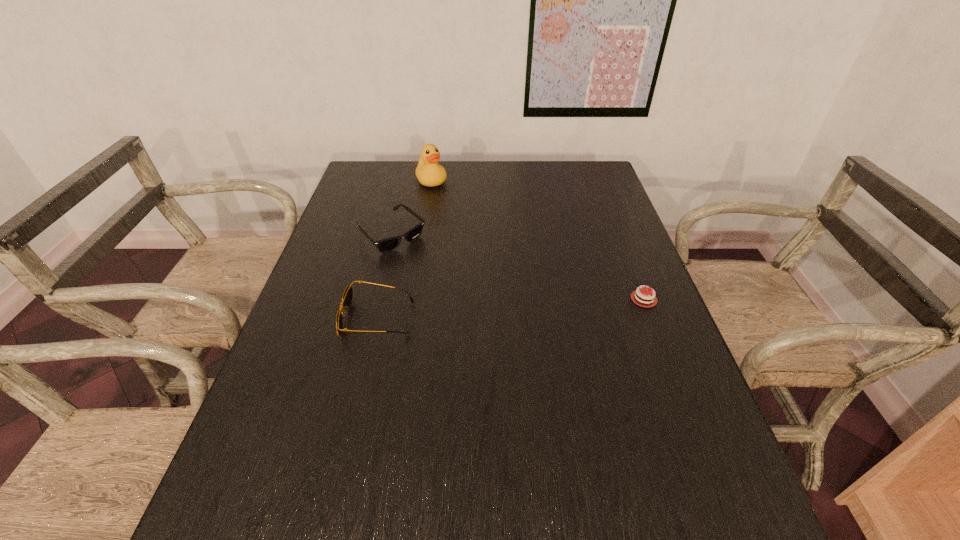
Where is `empty location between the nearer sunglasses and the farther sunglasses`? Image resolution: width=960 pixels, height=540 pixels. empty location between the nearer sunglasses and the farther sunglasses is located at coordinates [385, 277].

I want to click on free space that is in between the farther sunglasses and the nearer sunglasses, so click(385, 277).

Where is `free space that is in between the duck and the nearer sunglasses`? Image resolution: width=960 pixels, height=540 pixels. free space that is in between the duck and the nearer sunglasses is located at coordinates (405, 249).

Image resolution: width=960 pixels, height=540 pixels. I want to click on unoccupied position between the farther sunglasses and the chocolate cake, so click(x=517, y=267).

Identify which object is located as the second nearest to the nearer sunglasses. Please provide its 2D coordinates. Your answer should be formatted as a tuple, i.e. [(x, y)], where the tuple contains the x and y coordinates of a point satisfying the conditions above.

[(636, 297)]

The height and width of the screenshot is (540, 960). I want to click on object identified as the closest to the nearer sunglasses, so click(389, 244).

Where is `free location that satisfies the following two spatial constraints: 1. on the front side of the nearer sunglasses; 2. on the lenses of the farther sunglasses`? Image resolution: width=960 pixels, height=540 pixels. free location that satisfies the following two spatial constraints: 1. on the front side of the nearer sunglasses; 2. on the lenses of the farther sunglasses is located at coordinates (371, 319).

Locate an element on the screen. The height and width of the screenshot is (540, 960). free spot that satisfies the following two spatial constraints: 1. on the front side of the chocolate cake; 2. on the left side of the tallest object is located at coordinates (413, 299).

Find the location of a particular element. This screenshot has height=540, width=960. vacant space that satisfies the following two spatial constraints: 1. on the front side of the farther sunglasses; 2. on the lenses of the nearer sunglasses is located at coordinates (371, 319).